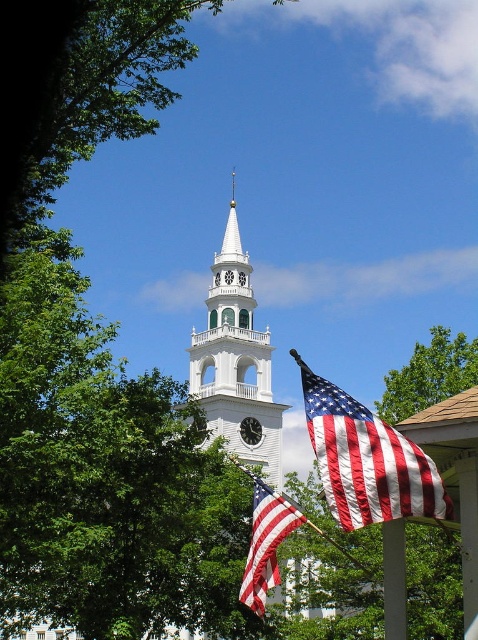
Question: Which point appears closest to the camera in this image?

Choices:
 (A) [x=415, y=499]
 (B) [x=247, y=426]
 (C) [x=261, y=406]
 (D) [x=289, y=525]

Answer: (A)

Question: Does american flag at lower right have a lesser width compared to green leafy tree at lower right?

Choices:
 (A) yes
 (B) no

Answer: (A)

Question: Which of the following is the farthest from the observer?

Choices:
 (A) (471, 355)
 (B) (312, 374)
 (C) (307, 518)

Answer: (A)

Question: Is metallic flag pole at lower center wider than american flag at lower center?

Choices:
 (A) no
 (B) yes

Answer: (B)

Question: Is green leafy tree at lower right bigger than metallic flag pole at lower center?

Choices:
 (A) yes
 (B) no

Answer: (B)

Question: Which of the following is the closest to the observer?

Choices:
 (A) (254, 496)
 (B) (237, 356)
 (C) (330, 460)

Answer: (C)